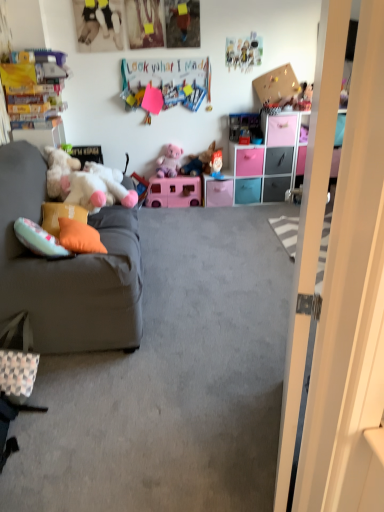
This screenshot has width=384, height=512. I want to click on vacant space behind white glossy door at right, so click(235, 376).